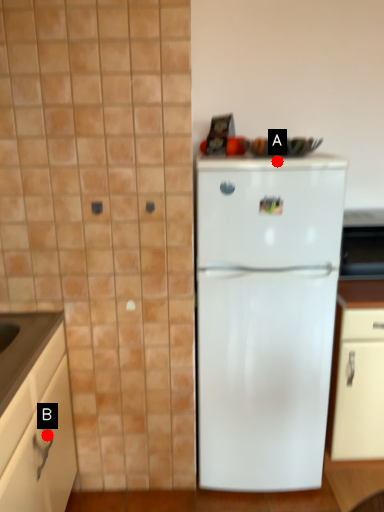
Question: Two points are circled on the image, labeled by A and B beside each circle. Which point is closer to the camera?

Choices:
 (A) A is closer
 (B) B is closer

Answer: (B)